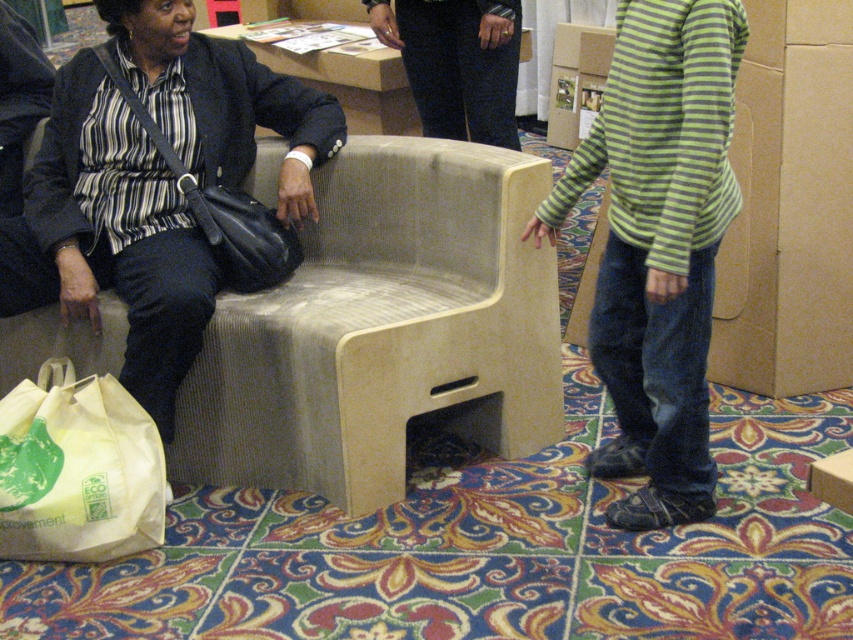
You are organizing a small event and need to place a 1.2 meter wide table between the beige fabric armchair at center and the black leather bag at left. Can the table fit in the space between them?

The beige fabric armchair at center is bigger than the black leather bag at left, but the exact distance between them isn t provided. Without knowing the actual space between the two objects, it s impossible to determine if the 1.2 meter wide table can fit.

You are a security guard at the event and need to check the contents of both the matte black purse at left and the black leather bag at left. Which one is easier to access without moving the person?

The matte black purse at left is below the black leather bag at left, so the black leather bag at left is easier to access without moving the person since it is positioned higher and more reachable.

What object is located at the coordinates point (383, 330) in the scene?

The beige fabric armchair at center is located at point (383, 330).